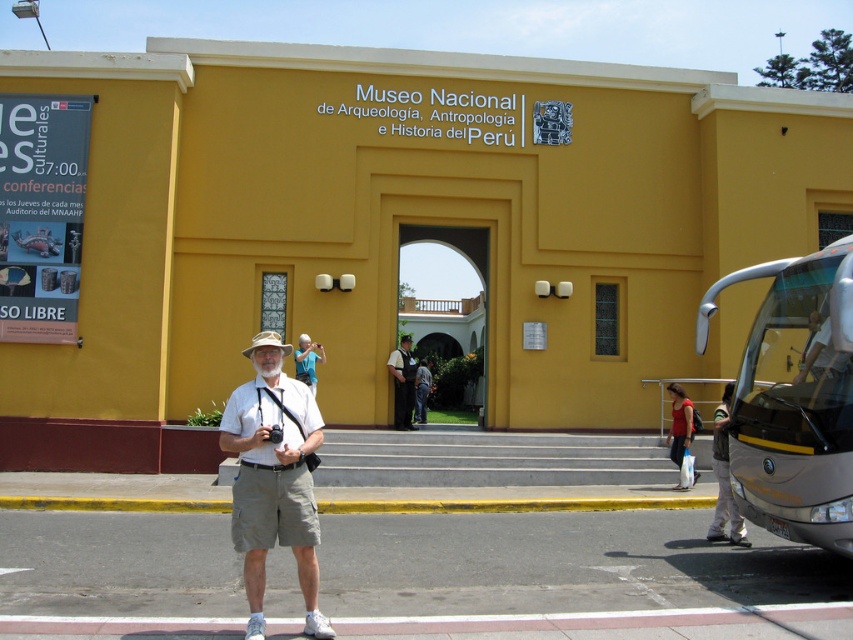
Question: Which point is closer to the camera taking this photo?

Choices:
 (A) (303, 371)
 (B) (672, 449)
 (C) (729, 516)

Answer: (C)

Question: Can you confirm if silver metallic bus at right is positioned below khaki cotton shorts at center?

Choices:
 (A) yes
 (B) no

Answer: (B)

Question: Which point appears closest to the camera in this image?

Choices:
 (A) (770, 435)
 (B) (672, 396)
 (C) (403, 413)

Answer: (A)

Question: Which point is farther from the camera taking this photo?

Choices:
 (A) (798, 484)
 (B) (715, 452)

Answer: (B)

Question: Is silver metallic bus at right positioned in front of matte red shirt at lower right?

Choices:
 (A) no
 (B) yes

Answer: (B)

Question: Can you confirm if denim pants at lower right is positioned above matte red shirt at lower right?

Choices:
 (A) no
 (B) yes

Answer: (B)